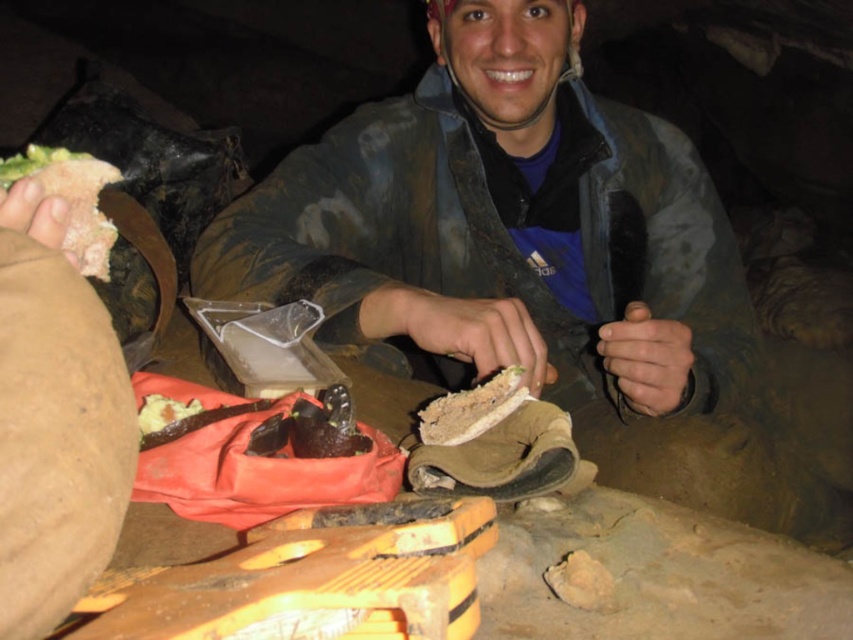
You are inside a cave and want to place a small rock between the two points marked as point (444, 419) and point (141, 420). Which point is closer to you where you should place the rock to be in front of both?

Point (141, 420) is closer to you, so placing the rock there would position it in front of both points.

You are a cave explorer who needs to choose between the sandy brown bread at center and the brown crumbly bread at center for your next meal. If you prefer a larger piece of bread, which one should you pick?

The sandy brown bread at center is wider than the brown crumbly bread at center, so you should pick the sandy brown bread at center for a larger piece.